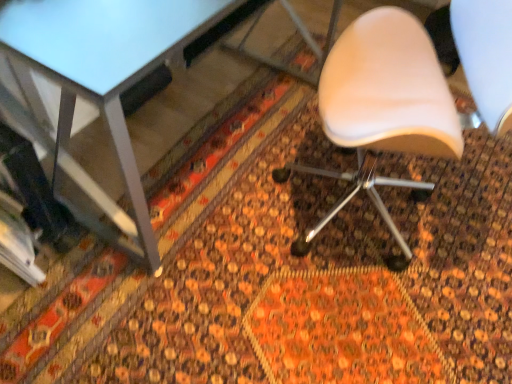
Where is `metallic gray table at upper left`? This screenshot has width=512, height=384. metallic gray table at upper left is located at coordinates (106, 69).

Describe the element at coordinates (106, 69) in the screenshot. Image resolution: width=512 pixels, height=384 pixels. I see `metallic gray table at upper left` at that location.

Where is `white leather chair at center`? The width and height of the screenshot is (512, 384). white leather chair at center is located at coordinates (382, 110).

What do you see at coordinates (382, 110) in the screenshot? The height and width of the screenshot is (384, 512). I see `white leather chair at center` at bounding box center [382, 110].

Where is `metallic gray table at upper left`? metallic gray table at upper left is located at coordinates (106, 69).

Does white leather chair at center appear on the right side of metallic gray table at upper left?

Yes, white leather chair at center is to the right of metallic gray table at upper left.

Between white leather chair at center and metallic gray table at upper left, which one is positioned in front?

white leather chair at center is in front.

Does point (425, 66) lie in front of point (166, 37)?

No, (425, 66) is further to viewer.

From the image's perspective, is white leather chair at center located beneath metallic gray table at upper left?

Yes, from the image's perspective, white leather chair at center is beneath metallic gray table at upper left.

From a real-world perspective, which object rests below the other?

metallic gray table at upper left, from a real-world perspective.

Considering the relative sizes of white leather chair at center and metallic gray table at upper left in the image provided, is white leather chair at center wider than metallic gray table at upper left?

Yes, white leather chair at center is wider than metallic gray table at upper left.

Considering the relative sizes of white leather chair at center and metallic gray table at upper left in the image provided, is white leather chair at center shorter than metallic gray table at upper left?

In fact, white leather chair at center may be taller than metallic gray table at upper left.

Which of these two, white leather chair at center or metallic gray table at upper left, is bigger?

Bigger between the two is metallic gray table at upper left.

Is white leather chair at center spatially inside metallic gray table at upper left, or outside of it?

white leather chair at center cannot be found inside metallic gray table at upper left.

Are white leather chair at center and metallic gray table at upper left far apart?

white leather chair at center is actually quite close to metallic gray table at upper left.

Is metallic gray table at upper left at the back of white leather chair at center?

white leather chair at center does not have its back to metallic gray table at upper left.

Can you tell me how much white leather chair at center and metallic gray table at upper left differ in facing direction?

They differ by 154 degrees in their facing directions.

Find the location of `chair in front of the metallic gray table at upper left`. chair in front of the metallic gray table at upper left is located at coordinates (382, 110).

Visually, is metallic gray table at upper left positioned to the left or to the right of white leather chair at center?

Based on their positions, metallic gray table at upper left is located to the left of white leather chair at center.

Is metallic gray table at upper left further to camera compared to white leather chair at center?

Yes, metallic gray table at upper left is further from the camera.

Is point (8, 34) in front of point (276, 169)?

Yes.

From the image's perspective, is metallic gray table at upper left located beneath white leather chair at center?

Actually, metallic gray table at upper left appears above white leather chair at center in the image.

From a real-world perspective, between metallic gray table at upper left and white leather chair at center, who is vertically higher?

white leather chair at center.

In terms of width, does metallic gray table at upper left look wider or thinner when compared to white leather chair at center?

In the image, metallic gray table at upper left appears to be more narrow than white leather chair at center.

Considering the relative sizes of metallic gray table at upper left and white leather chair at center in the image provided, is metallic gray table at upper left shorter than white leather chair at center?

Correct, metallic gray table at upper left is not as tall as white leather chair at center.

Who is smaller, metallic gray table at upper left or white leather chair at center?

With smaller size is white leather chair at center.

Is metallic gray table at upper left inside or outside of white leather chair at center?

metallic gray table at upper left is located beyond the bounds of white leather chair at center.

Is metallic gray table at upper left directly adjacent to white leather chair at center?

No, metallic gray table at upper left is not next to white leather chair at center.

Is metallic gray table at upper left oriented towards white leather chair at center?

Yes, metallic gray table at upper left is turned towards white leather chair at center.

Image resolution: width=512 pixels, height=384 pixels. Identify the location of table located underneath the white leather chair at center (from a real-world perspective). (106, 69).

Identify the location of table behind the white leather chair at center. Image resolution: width=512 pixels, height=384 pixels. (106, 69).

I want to click on table to the left of white leather chair at center, so click(106, 69).